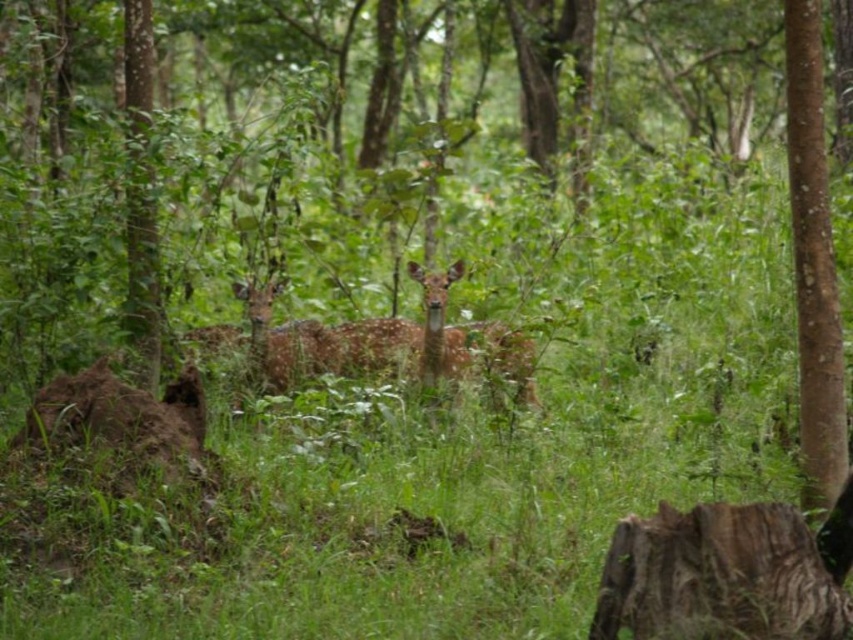
Question: Among these points, which one is nearest to the camera?

Choices:
 (A) (204, 333)
 (B) (804, 152)

Answer: (B)

Question: Is brown smooth tree trunk at right thinner than spotted fur deer at center?

Choices:
 (A) yes
 (B) no

Answer: (A)

Question: Which point is farther from the camera taking this photo?

Choices:
 (A) (218, 344)
 (B) (830, 339)

Answer: (A)

Question: Which of the following is the farthest from the observer?

Choices:
 (A) (833, 422)
 (B) (450, 280)

Answer: (B)

Question: Is brown smooth tree trunk at right smaller than spotted fur deer at center?

Choices:
 (A) no
 (B) yes

Answer: (B)

Question: Is brown smooth tree trunk at right above spotted fur deer at center?

Choices:
 (A) no
 (B) yes

Answer: (B)